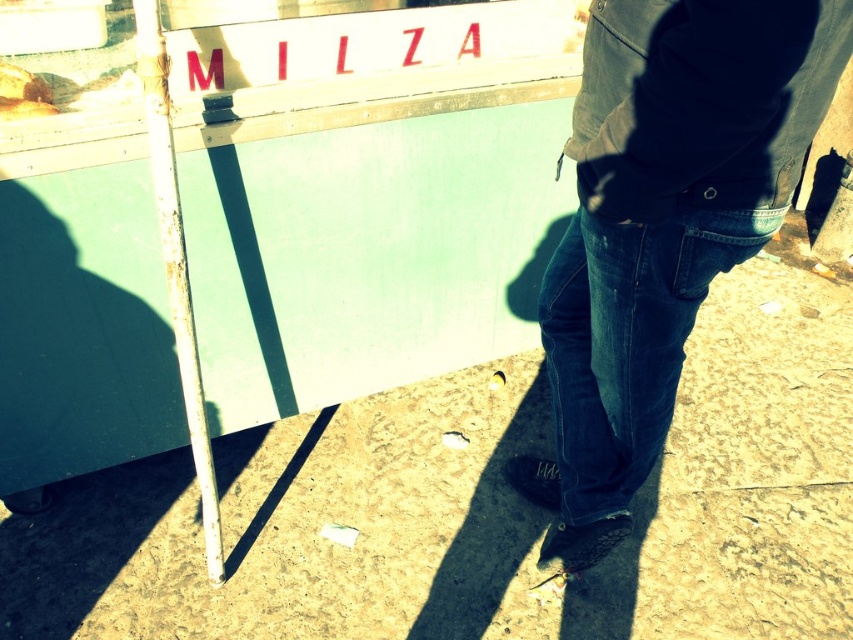
Question: Considering the relative positions of brown textured pavement at lower center and dark blue jeans at lower right in the image provided, where is brown textured pavement at lower center located with respect to dark blue jeans at lower right?

Choices:
 (A) right
 (B) left

Answer: (A)

Question: Considering the real-world distances, which object is closest to the dark blue jeans at lower right?

Choices:
 (A) brown textured pavement at lower center
 (B) denim at right

Answer: (B)

Question: Can you confirm if brown textured pavement at lower center is positioned above dark blue jeans at lower right?

Choices:
 (A) no
 (B) yes

Answer: (A)

Question: Which object is closer to the camera taking this photo?

Choices:
 (A) brown textured pavement at lower center
 (B) denim at right
 (C) dark blue jeans at lower right

Answer: (C)

Question: Is the position of dark blue jeans at lower right more distant than that of denim at right?

Choices:
 (A) no
 (B) yes

Answer: (A)

Question: Which of the following is the farthest from the observer?

Choices:
 (A) denim at right
 (B) brown textured pavement at lower center
 (C) dark blue jeans at lower right

Answer: (B)